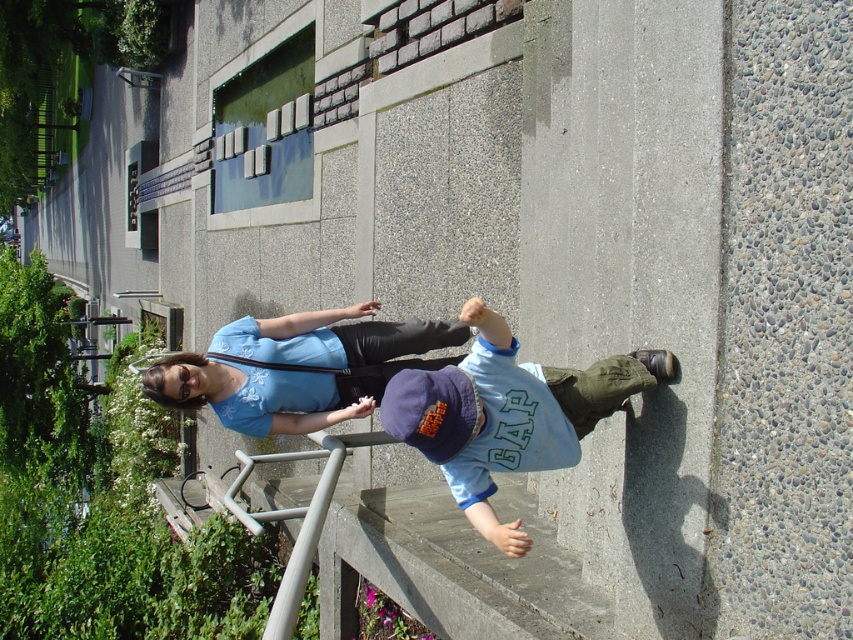
Question: Does blue cotton shirt at center have a lesser width compared to matte blue shirt at center?

Choices:
 (A) yes
 (B) no

Answer: (A)

Question: Is blue cotton shirt at center above matte blue shirt at center?

Choices:
 (A) yes
 (B) no

Answer: (B)

Question: Does blue cotton shirt at center have a greater width compared to matte blue shirt at center?

Choices:
 (A) no
 (B) yes

Answer: (A)

Question: Which object is closer to the camera taking this photo?

Choices:
 (A) matte blue shirt at center
 (B) blue cotton shirt at center

Answer: (B)

Question: Which point is closer to the camera?

Choices:
 (A) (473, 513)
 (B) (346, 368)

Answer: (A)